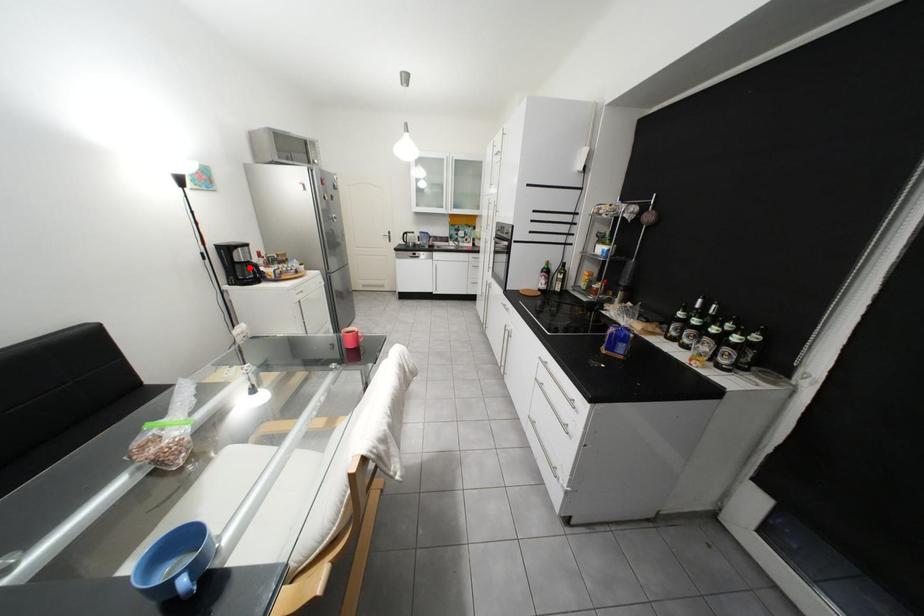
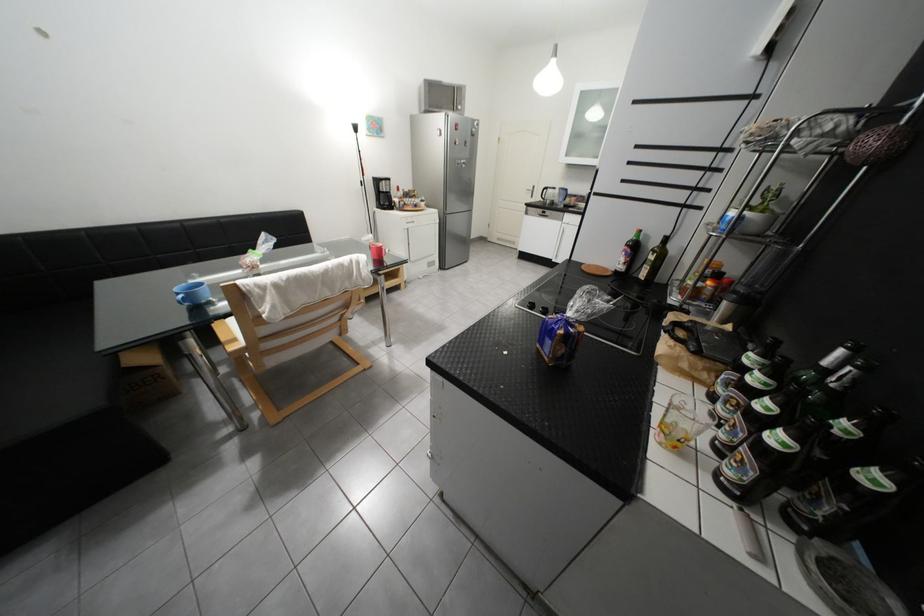
Question: A red point is marked in image1. In image2, is the corresponding 3D point closer to the camera or farther? Reply with the corresponding letter.

Choices:
 (A) The corresponding 3D point is closer.
 (B) The corresponding 3D point is farther.

Answer: (A)